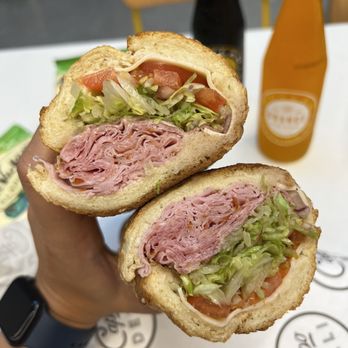
Identify the location of tablecloth. (27, 79).